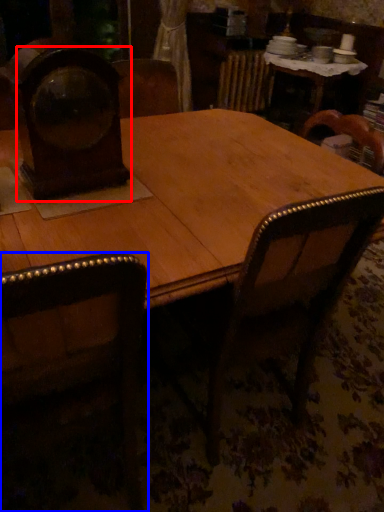
Question: Which object appears farthest to the camera in this image, clock (highlighted by a red box) or chair (highlighted by a blue box)?

Choices:
 (A) clock
 (B) chair

Answer: (A)